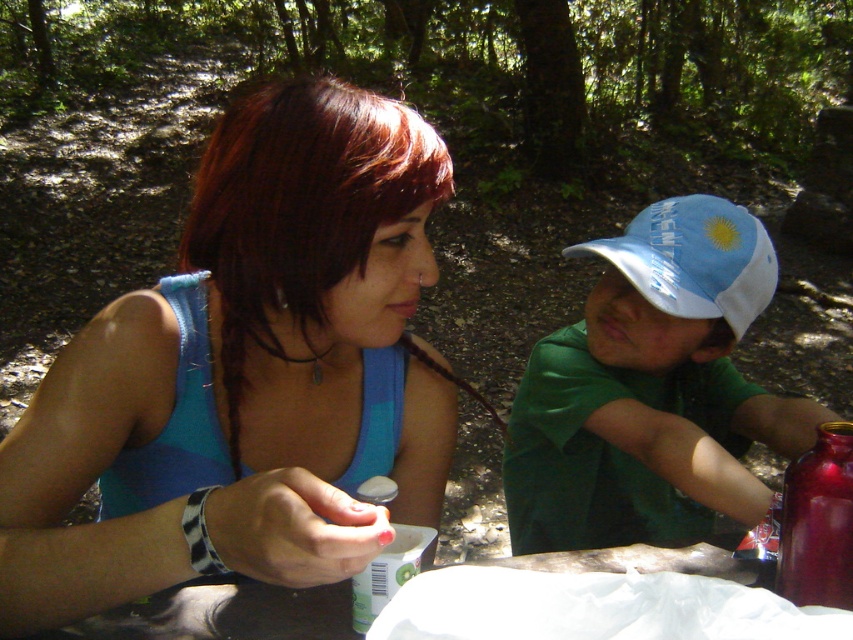
Does blue fabric baseball cap at upper right appear under shiny metallic bottle at right?

No, blue fabric baseball cap at upper right is not below shiny metallic bottle at right.

Which of these two, blue fabric baseball cap at upper right or shiny metallic bottle at right, stands shorter?

Standing shorter between the two is shiny metallic bottle at right.

Which is behind, point (752, 307) or point (792, 476)?

Positioned behind is point (752, 307).

Where is `blue fabric baseball cap at upper right`? blue fabric baseball cap at upper right is located at coordinates (694, 259).

Which of these two, white mesh cap at right or blue fabric baseball cap at upper right, stands shorter?

With less height is blue fabric baseball cap at upper right.

Does white mesh cap at right have a larger size compared to blue fabric baseball cap at upper right?

Indeed, white mesh cap at right has a larger size compared to blue fabric baseball cap at upper right.

Which is behind, point (750, 227) or point (657, 244)?

Positioned behind is point (750, 227).

Locate an element on the screen. This screenshot has height=640, width=853. white mesh cap at right is located at coordinates (651, 390).

Is matte blue tank top at center to the left of shiny metallic bottle at right from the viewer's perspective?

Yes, matte blue tank top at center is to the left of shiny metallic bottle at right.

This screenshot has width=853, height=640. What do you see at coordinates (245, 374) in the screenshot?
I see `matte blue tank top at center` at bounding box center [245, 374].

The image size is (853, 640). What do you see at coordinates (245, 374) in the screenshot?
I see `matte blue tank top at center` at bounding box center [245, 374].

Locate an element on the screen. matte blue tank top at center is located at coordinates (245, 374).